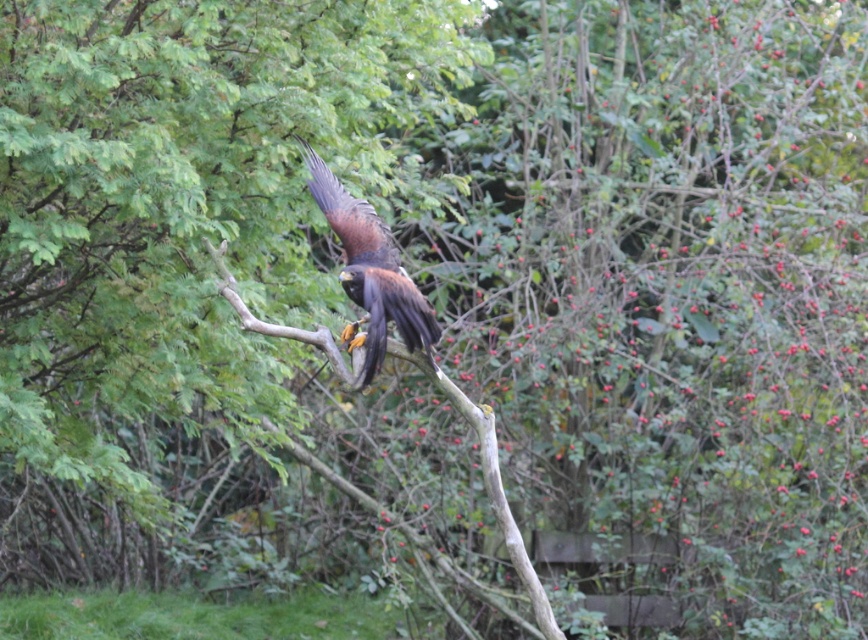
You are a nature photographer aiming to capture the brown feathered eagle at center and the brown wood tree branch at center in your shot. Based on their positions, which object should you focus on first if you want to ensure both are in sharp focus?

The brown feathered eagle at center is located above the brown wood tree branch at center. To ensure both are in sharp focus, you should focus on the brown wood tree branch at center first since it is closer to the camera than the eagle.

You are a photographer trying to capture the brown feathered eagle at center and the brown wood tree branch at center in a single shot. Which object appears in front of the other in the image?

The brown feathered eagle at center is closer to the viewer than the brown wood tree branch at center, so it appears in front of the branch in the image.

You are a nature photographer aiming to capture the brown feathered eagle at center and the brown wood tree branch at center in a single frame. Based on their positions, which object should you adjust your camera focus to first to ensure both are in the shot?

The brown wood tree branch at center is to the left of the brown feathered eagle at center, so you should focus on the brown wood tree branch at center first to ensure both are in the frame.